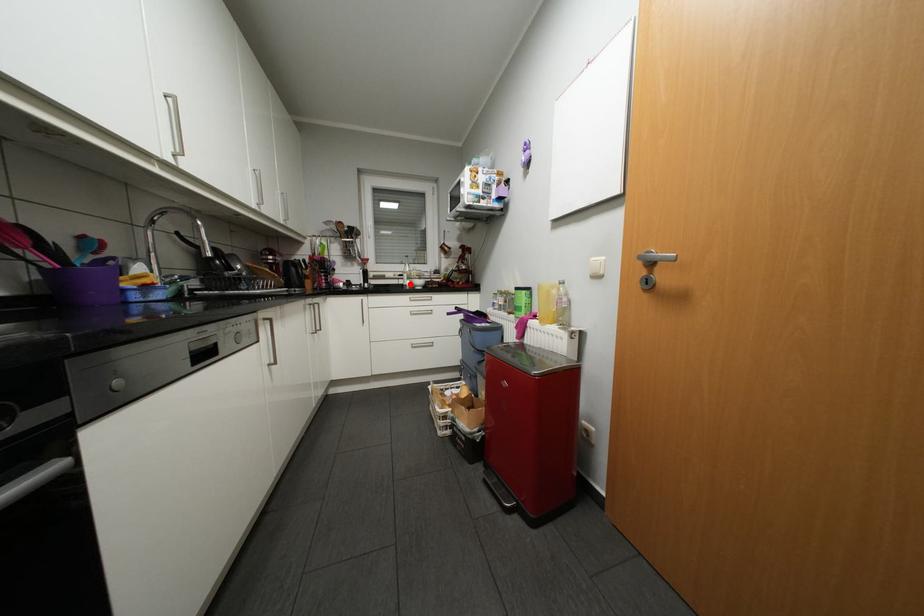
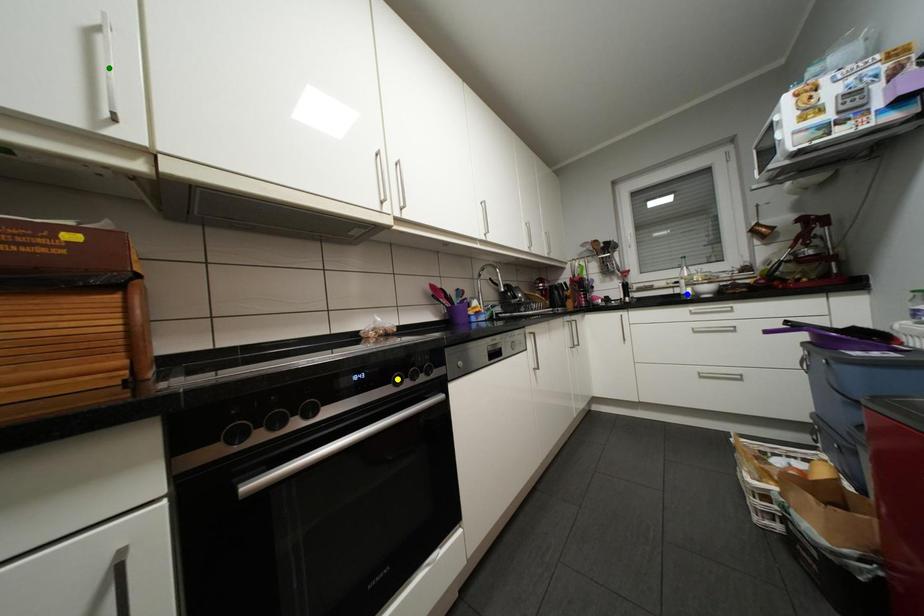
Question: I am providing you with two images of the same scene from different viewpoints. A red point is marked on the first image. You are given multiple points on the second image. Which spot in image 2 lines up with the point in image 1?

Choices:
 (A) blue point
 (B) yellow point
 (C) green point

Answer: (A)